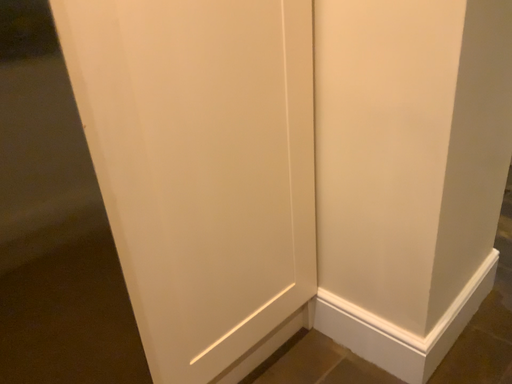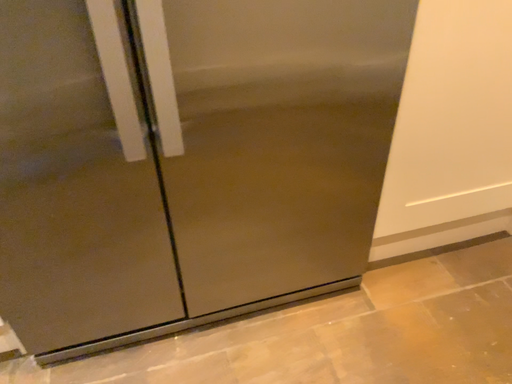
Question: Which way did the camera rotate in the video?

Choices:
 (A) rotated downward
 (B) rotated upward

Answer: (A)